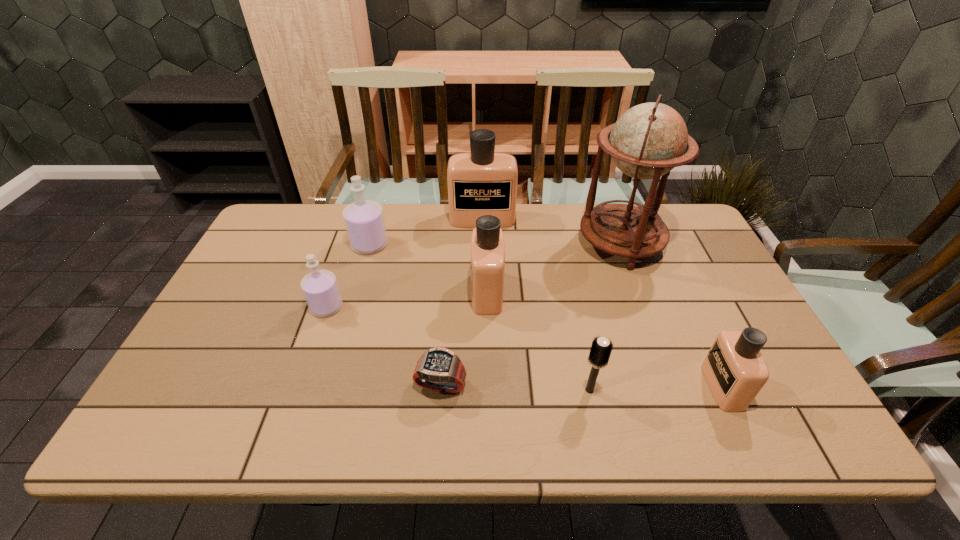
At what (x,y) coordinates should I click in order to perform the action: click on vacant area that lies between the second farthest perfume and the smaller purple perfume. Please return your answer as a coordinate pair (x, y). The width and height of the screenshot is (960, 540). Looking at the image, I should click on (348, 276).

Locate an element on the screen. The image size is (960, 540). free space between the nearest beige perfume and the bigger purple perfume is located at coordinates (546, 315).

Identify the location of vacant area that lies between the globe and the hairbrush. Image resolution: width=960 pixels, height=540 pixels. (605, 317).

Where is `free space between the nearer purple perfume and the second farthest beige perfume`? This screenshot has width=960, height=540. free space between the nearer purple perfume and the second farthest beige perfume is located at coordinates (407, 300).

Find the location of `vacant area between the nearer purple perfume and the rightmost perfume`. vacant area between the nearer purple perfume and the rightmost perfume is located at coordinates (524, 347).

What are the coordinates of `unoccupied position between the hairbrush and the nearest beige perfume` in the screenshot? It's located at (656, 388).

The width and height of the screenshot is (960, 540). I want to click on object that is the fifth closest to the bigger purple perfume, so click(650, 139).

Locate an element on the screen. object that ranks as the fourth closest to the sixth object from left to right is located at coordinates (650, 139).

Identify which perfume is the fifth closest to the globe. Please provide its 2D coordinates. Your answer should be formatted as a tuple, i.e. [(x, y)], where the tuple contains the x and y coordinates of a point satisfying the conditions above.

[(320, 288)]

Locate an element on the screen. The image size is (960, 540). the fifth closest perfume to the watch is located at coordinates click(x=482, y=182).